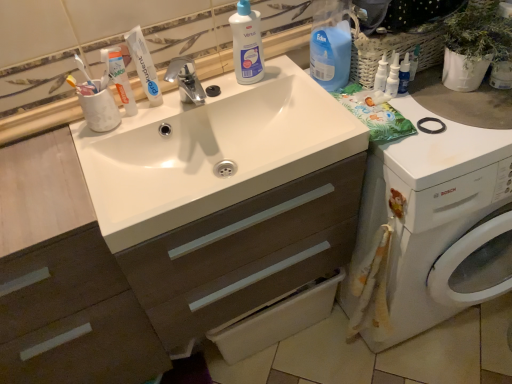
You are a GUI agent. You are given a task and a screenshot of the screen. Output one action in this format:
    pyautogui.click(x=<x>, y=<y>)
    Task: Click on the vacant area that is in front of white glossy spray bottle at upper right, positioned as the second cleaning product in right-to-left order
    
    Given the screenshot: What is the action you would take?
    pyautogui.click(x=426, y=135)